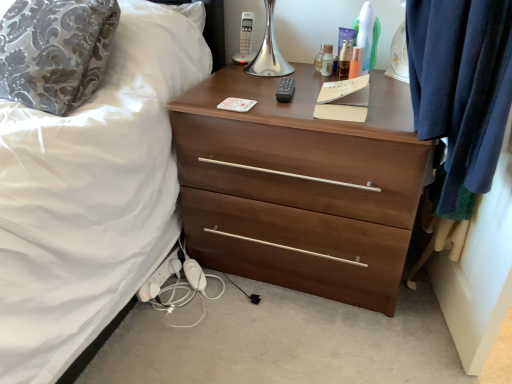
You are a GUI agent. You are given a task and a screenshot of the screen. Output one action in this format:
    pyautogui.click(x=<x>, y=<y>)
    Task: Click on the vacant area on top of brown wood chest of drawers at center (from a real-world perspective)
    
    Given the screenshot: What is the action you would take?
    pyautogui.click(x=298, y=92)